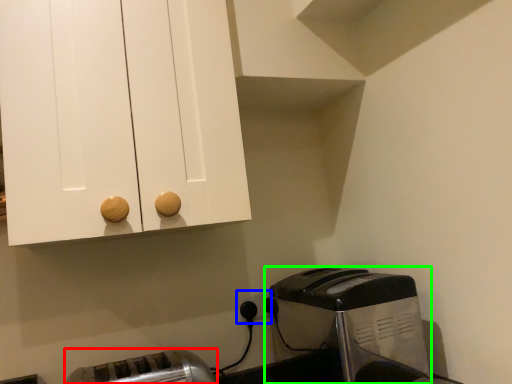
Question: Considering the real-world distances, which object is farthest from toaster (highlighted by a red box)? electric outlet (highlighted by a blue box) or toaster (highlighted by a green box)?

Choices:
 (A) electric outlet
 (B) toaster

Answer: (B)